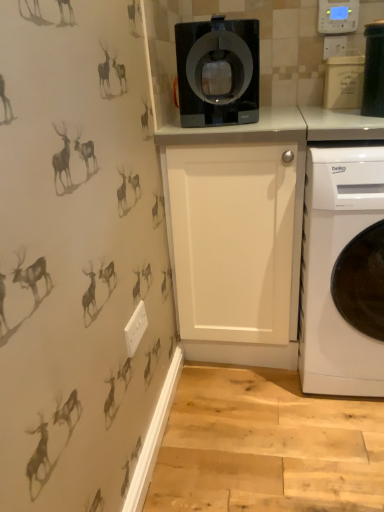
The width and height of the screenshot is (384, 512). What do you see at coordinates (374, 70) in the screenshot? I see `black plastic container at upper right, marked as the 1th appliance in a front-to-back arrangement` at bounding box center [374, 70].

What is the approximate width of black plastic container at upper right, placed as the 2th appliance when sorted from back to front?

black plastic container at upper right, placed as the 2th appliance when sorted from back to front, is 8.17 inches in width.

How much space does white matte container at upper right, arranged as the first appliance when viewed from the back, occupy horizontally?

4.76 inches.

Describe the element at coordinates (333, 266) in the screenshot. I see `white glossy washing machine at lower right` at that location.

This screenshot has height=512, width=384. I want to click on black plastic container at upper right, marked as the 1th appliance in a front-to-back arrangement, so click(374, 70).

How far apart are white matte container at upper right, arranged as the first appliance when viewed from the back, and white glossy washing machine at lower right?

25.30 inches.

From a real-world perspective, does white matte container at upper right, arranged as the first appliance when viewed from the back, sit lower than white glossy washing machine at lower right?

No, from a real-world perspective, white matte container at upper right, arranged as the first appliance when viewed from the back, is not beneath white glossy washing machine at lower right.

Which of these two, white matte container at upper right, which is counted as the second appliance, starting from the front, or white glossy washing machine at lower right, stands shorter?

Standing shorter between the two is white matte container at upper right, which is counted as the second appliance, starting from the front.

Is white glossy cabinet at center behind black plastic container at upper right, placed as the 2th appliance when sorted from back to front?

That is True.

From the picture: From the image's perspective, between white glossy cabinet at center and black plastic container at upper right, marked as the 1th appliance in a front-to-back arrangement, who is located below?

white glossy cabinet at center, from the image's perspective.

The width and height of the screenshot is (384, 512). Identify the location of counter that appears below the black plastic container at upper right, marked as the 1th appliance in a front-to-back arrangement (from the image's perspective). (243, 229).

Is white matte container at upper right, which is counted as the second appliance, starting from the front, directly adjacent to black plastic container at upper right, placed as the 2th appliance when sorted from back to front?

Yes, white matte container at upper right, which is counted as the second appliance, starting from the front, is next to black plastic container at upper right, placed as the 2th appliance when sorted from back to front.

From a real-world perspective, is white matte container at upper right, arranged as the first appliance when viewed from the back, located beneath black plastic container at upper right, placed as the 2th appliance when sorted from back to front?

Yes, from a real-world perspective, white matte container at upper right, arranged as the first appliance when viewed from the back, is beneath black plastic container at upper right, placed as the 2th appliance when sorted from back to front.

From the image's perspective, is white matte container at upper right, which is counted as the second appliance, starting from the front, below black plastic container at upper right, placed as the 2th appliance when sorted from back to front?

Actually, white matte container at upper right, which is counted as the second appliance, starting from the front, appears above black plastic container at upper right, placed as the 2th appliance when sorted from back to front, in the image.

Is white matte container at upper right, which is counted as the second appliance, starting from the front, oriented away from black plastic container at upper right, placed as the 2th appliance when sorted from back to front?

No.

Does black glossy coffee machine at upper center have a greater height compared to black plastic container at upper right, marked as the 1th appliance in a front-to-back arrangement?

Yes, black glossy coffee machine at upper center is taller than black plastic container at upper right, marked as the 1th appliance in a front-to-back arrangement.

Could you tell me if black glossy coffee machine at upper center is facing black plastic container at upper right, placed as the 2th appliance when sorted from back to front?

No, black glossy coffee machine at upper center is not turned towards black plastic container at upper right, placed as the 2th appliance when sorted from back to front.

From a real-world perspective, is black glossy coffee machine at upper center physically above black plastic container at upper right, marked as the 1th appliance in a front-to-back arrangement?

Indeed, from a real-world perspective, black glossy coffee machine at upper center stands above black plastic container at upper right, marked as the 1th appliance in a front-to-back arrangement.

Who is smaller, black plastic container at upper right, marked as the 1th appliance in a front-to-back arrangement, or white matte container at upper right, arranged as the first appliance when viewed from the back?

white matte container at upper right, arranged as the first appliance when viewed from the back.

From the image's perspective, who appears lower, black plastic container at upper right, placed as the 2th appliance when sorted from back to front, or white matte container at upper right, which is counted as the second appliance, starting from the front?

From the image's view, black plastic container at upper right, placed as the 2th appliance when sorted from back to front, is below.

Where is `appliance in front of the white matte container at upper right, which is counted as the second appliance, starting from the front`? This screenshot has width=384, height=512. appliance in front of the white matte container at upper right, which is counted as the second appliance, starting from the front is located at coordinates (374, 70).

Consider the image. How distant is black plastic container at upper right, marked as the 1th appliance in a front-to-back arrangement, from white matte container at upper right, which is counted as the second appliance, starting from the front?

black plastic container at upper right, marked as the 1th appliance in a front-to-back arrangement, and white matte container at upper right, which is counted as the second appliance, starting from the front, are 2.39 inches apart from each other.

Could you tell me if black plastic container at upper right, placed as the 2th appliance when sorted from back to front, is facing white glossy cabinet at center?

No.

Which is behind, black plastic container at upper right, marked as the 1th appliance in a front-to-back arrangement, or white glossy cabinet at center?

white glossy cabinet at center is further from the camera.

From a real-world perspective, which is physically below, black plastic container at upper right, marked as the 1th appliance in a front-to-back arrangement, or white glossy cabinet at center?

white glossy cabinet at center is physically lower.

Is black plastic container at upper right, marked as the 1th appliance in a front-to-back arrangement, at the right side of white glossy cabinet at center?

Indeed, black plastic container at upper right, marked as the 1th appliance in a front-to-back arrangement, is positioned on the right side of white glossy cabinet at center.

At what (x,y) coordinates should I click in order to perform the action: click on washing machine lying in front of the black glossy coffee machine at upper center. Please return your answer as a coordinate pair (x, y). Looking at the image, I should click on (333, 266).

Which is more to the left, white glossy washing machine at lower right or black glossy coffee machine at upper center?

From the viewer's perspective, black glossy coffee machine at upper center appears more on the left side.

From a real-world perspective, does white glossy washing machine at lower right sit lower than black glossy coffee machine at upper center?

Yes.

From the image's perspective, which one is positioned higher, white glossy washing machine at lower right or black glossy coffee machine at upper center?

black glossy coffee machine at upper center.

Starting from the white glossy washing machine at lower right, which appliance is the 2nd one behind? Please provide its 2D coordinates.

[(344, 82)]

Starting from the white glossy cabinet at center, which appliance is the 2nd one to the right? Please provide its 2D coordinates.

[(374, 70)]

Based on their spatial positions, is white matte container at upper right, which is counted as the second appliance, starting from the front, or black plastic container at upper right, marked as the 1th appliance in a front-to-back arrangement, closer to white glossy cabinet at center?

white matte container at upper right, which is counted as the second appliance, starting from the front.

Estimate the real-world distances between objects in this image. Which object is further from black plastic container at upper right, placed as the 2th appliance when sorted from back to front, white matte container at upper right, which is counted as the second appliance, starting from the front, or white glossy cabinet at center?

The object further to black plastic container at upper right, placed as the 2th appliance when sorted from back to front, is white glossy cabinet at center.

From the picture: Estimate the real-world distances between objects in this image. Which object is further from white matte container at upper right, arranged as the first appliance when viewed from the back, white glossy washing machine at lower right or black glossy coffee machine at upper center?

The object further to white matte container at upper right, arranged as the first appliance when viewed from the back, is white glossy washing machine at lower right.

When comparing their distances from white glossy washing machine at lower right, does black glossy coffee machine at upper center or white matte container at upper right, arranged as the first appliance when viewed from the back, seem further?

Based on the image, white matte container at upper right, arranged as the first appliance when viewed from the back, appears to be further to white glossy washing machine at lower right.

When comparing their distances from white matte container at upper right, arranged as the first appliance when viewed from the back, does black plastic container at upper right, placed as the 2th appliance when sorted from back to front, or white glossy washing machine at lower right seem further?

white glossy washing machine at lower right lies further to white matte container at upper right, arranged as the first appliance when viewed from the back, than the other object.

Considering their positions, is black glossy coffee machine at upper center positioned closer to white glossy washing machine at lower right than black plastic container at upper right, marked as the 1th appliance in a front-to-back arrangement?

Among the two, black glossy coffee machine at upper center is located nearer to white glossy washing machine at lower right.

When comparing their distances from black glossy coffee machine at upper center, does white matte container at upper right, which is counted as the second appliance, starting from the front, or white glossy cabinet at center seem further?

white matte container at upper right, which is counted as the second appliance, starting from the front.

Based on their spatial positions, is white matte container at upper right, arranged as the first appliance when viewed from the back, or white glossy washing machine at lower right closer to black glossy coffee machine at upper center?

white matte container at upper right, arranged as the first appliance when viewed from the back, is positioned closer to the anchor black glossy coffee machine at upper center.

Locate an element on the screen. The width and height of the screenshot is (384, 512). counter between black plastic container at upper right, marked as the 1th appliance in a front-to-back arrangement, and white glossy washing machine at lower right, in the vertical direction is located at coordinates (243, 229).

Identify the location of appliance that lies between white matte container at upper right, arranged as the first appliance when viewed from the back, and white glossy washing machine at lower right from top to bottom. (374, 70).

What are the coordinates of `appliance between white matte container at upper right, arranged as the first appliance when viewed from the back, and white glossy cabinet at center vertically` in the screenshot? It's located at (374, 70).

This screenshot has height=512, width=384. In order to click on appliance situated between black glossy coffee machine at upper center and black plastic container at upper right, marked as the 1th appliance in a front-to-back arrangement, from left to right in this screenshot , I will do `click(344, 82)`.